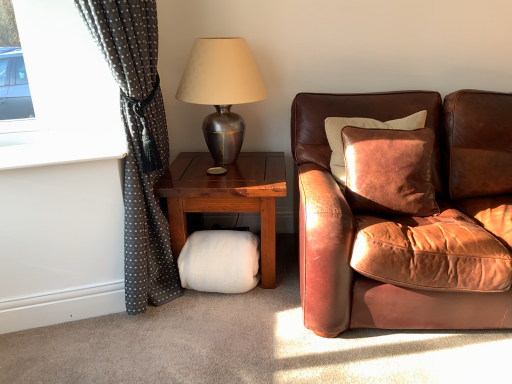
Find the location of a particular element. The image size is (512, 384). free location in front of dark grey polka dot fabric at left is located at coordinates (117, 360).